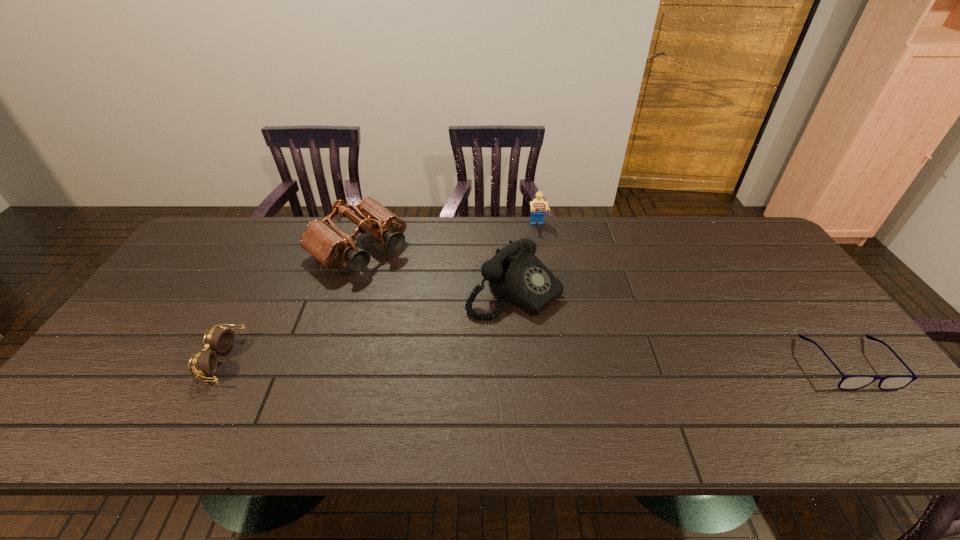
Select which object appears as the second closest to the rightmost object. Please provide its 2D coordinates. Your answer should be formatted as a tuple, i.e. [(x, y)], where the tuple contains the x and y coordinates of a point satisfying the conditions above.

[(537, 205)]